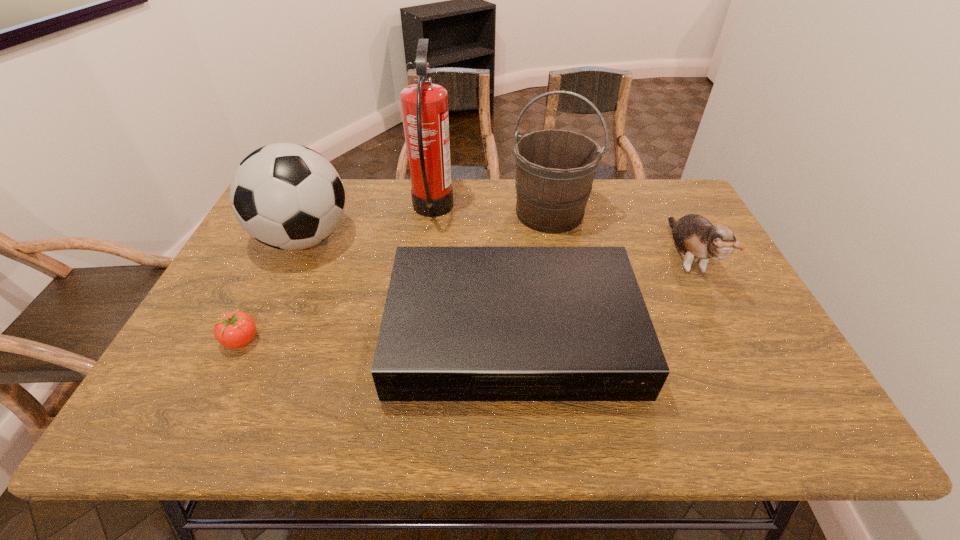
The width and height of the screenshot is (960, 540). I want to click on object that is at the far left corner, so click(287, 196).

This screenshot has height=540, width=960. What are the coordinates of `free space at the far edge` in the screenshot? It's located at (503, 220).

Image resolution: width=960 pixels, height=540 pixels. What are the coordinates of `vacant space at the near edge of the desktop` in the screenshot? It's located at (254, 427).

Identify the location of free space at the left edge of the desktop. (224, 284).

Image resolution: width=960 pixels, height=540 pixels. Identify the location of vacant space at the right edge of the desktop. click(737, 300).

You are a GUI agent. You are given a task and a screenshot of the screen. Output one action in this format:
    pyautogui.click(x=<x>, y=<y>)
    Task: Click on the vacant space at the far right corner of the desktop
    The width and height of the screenshot is (960, 540).
    Given the screenshot: What is the action you would take?
    pyautogui.click(x=651, y=187)

Image resolution: width=960 pixels, height=540 pixels. I want to click on free point between the shortest object and the fourth shortest object, so click(x=273, y=289).

You are a GUI agent. You are given a task and a screenshot of the screen. Output one action in this format:
    pyautogui.click(x=<x>, y=<y>)
    Task: Click on the free area in between the tallest object and the rightmost object
    
    Given the screenshot: What is the action you would take?
    pyautogui.click(x=560, y=234)

Locate an element on the screen. vacant space that is in between the rightmost object and the bucket is located at coordinates (618, 235).

This screenshot has width=960, height=540. What are the coordinates of `unoccupied position between the fourth shortest object and the tallest object` in the screenshot? It's located at (369, 225).